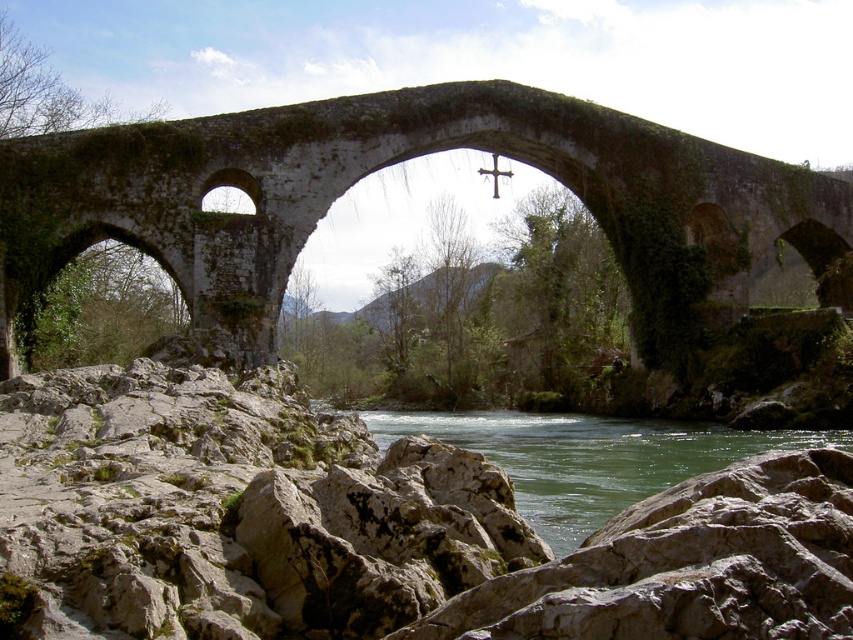
Can you confirm if gray rough rock at lower center is thinner than metallic cross at center?

In fact, gray rough rock at lower center might be wider than metallic cross at center.

Between gray rough rock at lower center and metallic cross at center, which one is positioned lower?

gray rough rock at lower center

Who is more forward, (148, 380) or (495, 172)?

Point (148, 380) is in front.

Where is `gray rough rock at lower center`? This screenshot has width=853, height=640. gray rough rock at lower center is located at coordinates (x=374, y=528).

Does green stone river at center have a greater width compared to metallic cross at center?

Correct, the width of green stone river at center exceeds that of metallic cross at center.

Locate an element on the screen. green stone river at center is located at coordinates (589, 458).

Between gray rough rock at lower center and stone arch bridge at center, which one appears on the right side from the viewer's perspective?

Positioned to the right is stone arch bridge at center.

Does gray rough rock at lower center have a lesser width compared to stone arch bridge at center?

Indeed, gray rough rock at lower center has a lesser width compared to stone arch bridge at center.

In the scene shown: Who is more forward, (x=4, y=484) or (x=543, y=131)?

Point (x=4, y=484) is more forward.

Find the location of a particular element. The height and width of the screenshot is (640, 853). gray rough rock at lower center is located at coordinates (374, 528).